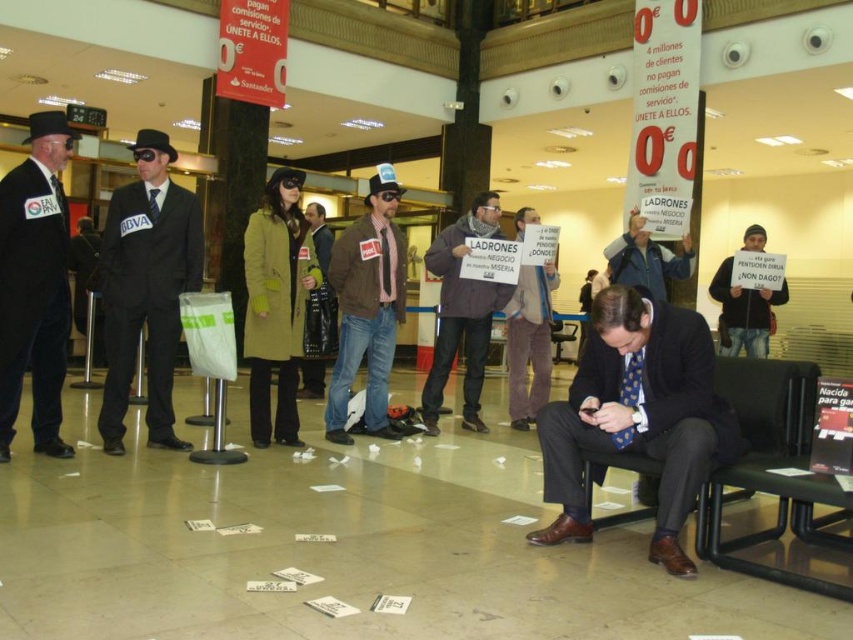
Consider the image. Between dark brown leather jacket at center and gray fabric jacket at center, which one has less height?

gray fabric jacket at center is shorter.

What do you see at coordinates (462, 312) in the screenshot? The width and height of the screenshot is (853, 640). I see `dark brown leather jacket at center` at bounding box center [462, 312].

I want to click on dark brown leather jacket at center, so click(462, 312).

Who is positioned more to the right, velvet black coat at left or matte black chair at center?

matte black chair at center is more to the right.

Can you confirm if velvet black coat at left is smaller than matte black chair at center?

No, velvet black coat at left is not smaller than matte black chair at center.

What do you see at coordinates (33, 284) in the screenshot? I see `velvet black coat at left` at bounding box center [33, 284].

Find the location of a particular element. velvet black coat at left is located at coordinates (33, 284).

Can you confirm if matte black suit at center is bigger than green wool coat at center?

No.

Measure the distance between point (165, 214) and camera.

The distance of point (165, 214) from camera is 4.61 meters.

Identify the location of matte black suit at center. The height and width of the screenshot is (640, 853). (146, 289).